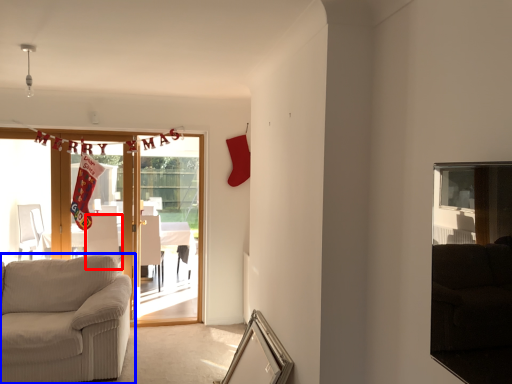
Question: Among these objects, which one is nearest to the camera, armchair (highlighted by a red box) or studio couch (highlighted by a blue box)?

Choices:
 (A) armchair
 (B) studio couch

Answer: (B)